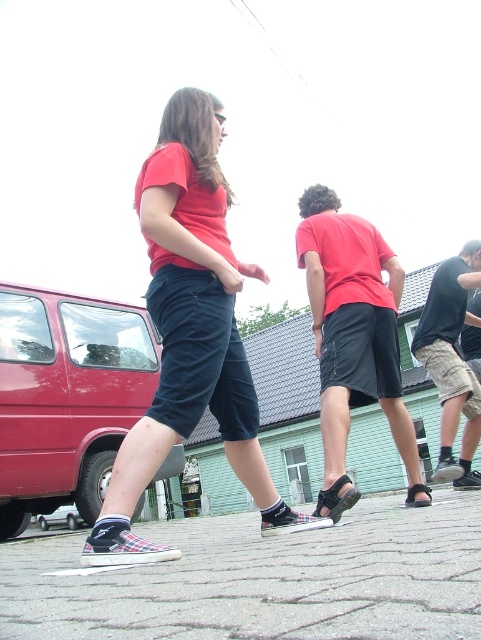
Based on the photo, you are standing at point (459, 468) and want to walk to point (118, 403). Are you able to see the person in the red tshirt and dark blue capri pants who is mid stride in your path?

Yes, because point (118, 403) is behind point (459, 468), so the person in the red tshirt and dark blue capri pants located at point (118, 403) would be obscured by point (459, 468), meaning you cannot see them while moving towards them.